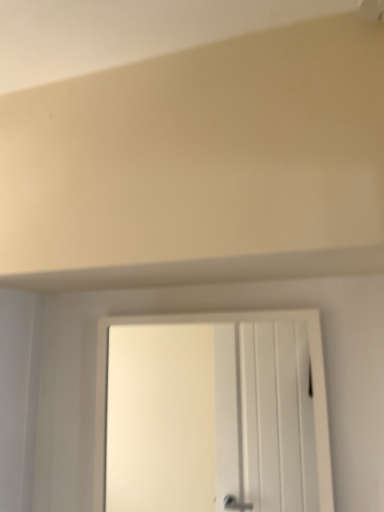
Find the location of a particular element. The image size is (384, 512). white matte door at center is located at coordinates (221, 322).

The height and width of the screenshot is (512, 384). What do you see at coordinates (221, 322) in the screenshot?
I see `white matte door at center` at bounding box center [221, 322].

At what (x,y) coordinates should I click in order to perform the action: click on white matte door at center. Please return your answer as a coordinate pair (x, y). This screenshot has width=384, height=512. Looking at the image, I should click on (221, 322).